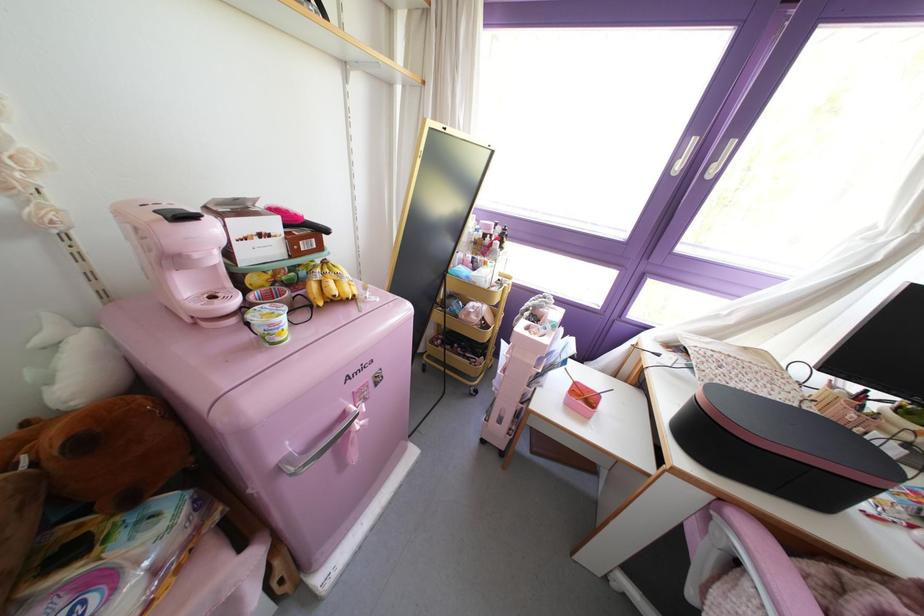
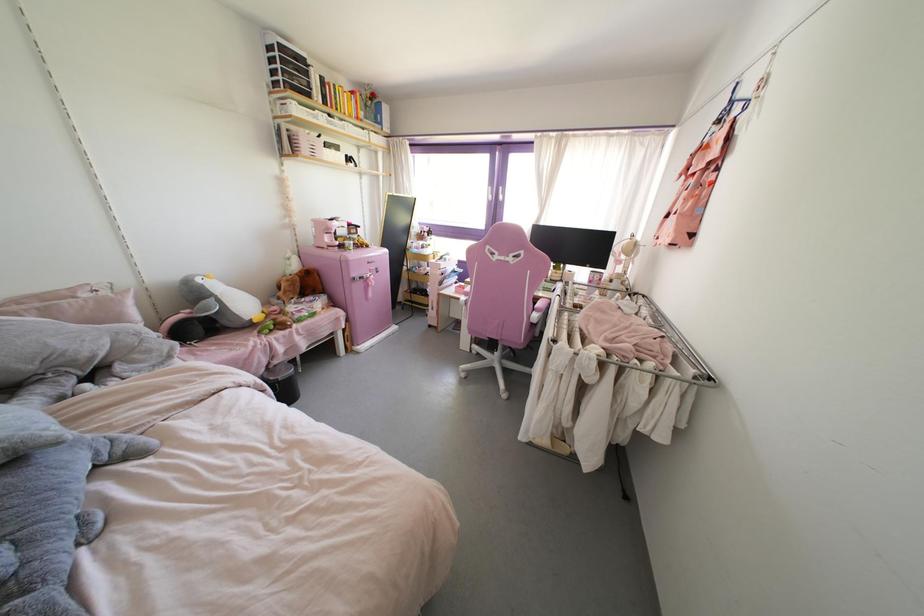
Find the pixel in the second image that matches [375,384] in the first image.

(377, 272)